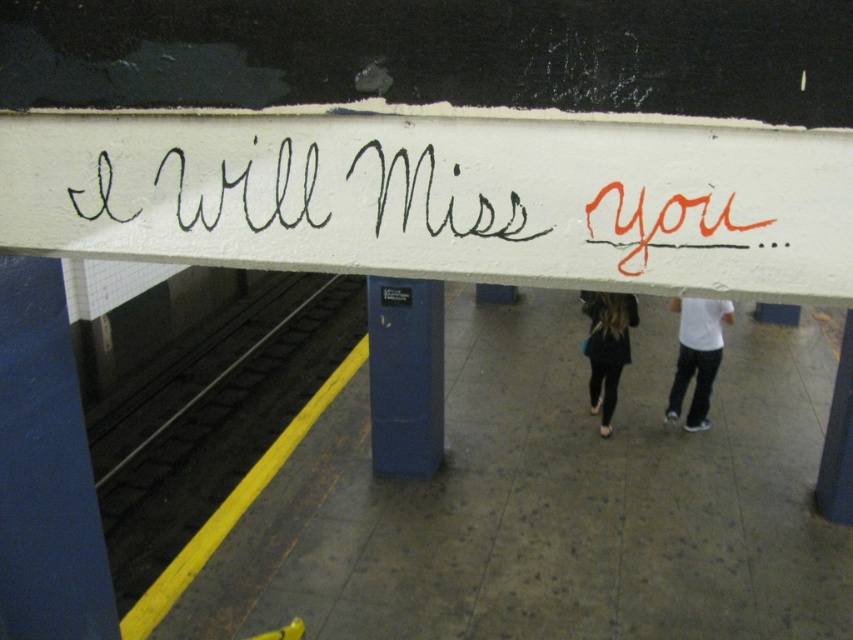
You are a visually impaired person standing on the yellow tactile paving strip. You want to avoid stepping into the path of the two people walking away. Which object, the yellow rubber at bottom left or the black leather pants at center, is closer to you?

The yellow rubber at bottom left is closer to you because it is shorter than the black leather pants at center, meaning it is positioned nearer on the platform.